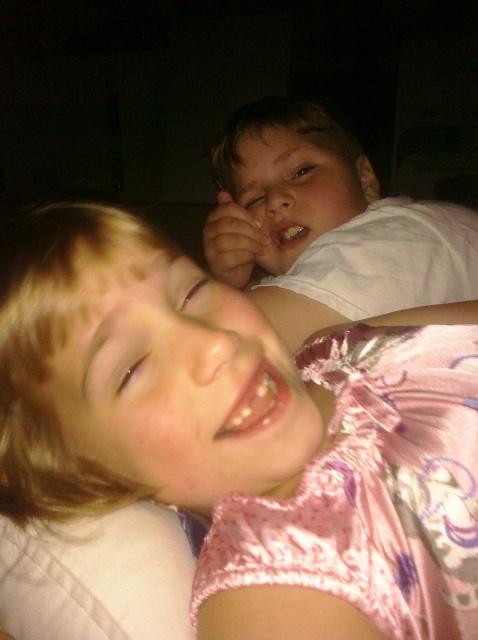
Question: Does white cotton shirt at upper center appear over smooth skin face at upper center?

Choices:
 (A) no
 (B) yes

Answer: (A)

Question: Is white cotton shirt at upper center smaller than white glossy teeth at center?

Choices:
 (A) yes
 (B) no

Answer: (B)

Question: Which object is the farthest from the smooth skin face at upper center?

Choices:
 (A) white glossy teeth at lower center
 (B) pink satin dress at center
 (C) white cotton shirt at upper center
 (D) white glossy teeth at center

Answer: (A)

Question: Among these objects, which one is nearest to the camera?

Choices:
 (A) white glossy teeth at lower center
 (B) smooth skin face at upper center
 (C) white cotton shirt at upper center
 (D) pink satin face at lower left

Answer: (D)

Question: Can you confirm if smooth skin face at upper center is positioned to the right of white glossy teeth at lower center?

Choices:
 (A) no
 (B) yes

Answer: (B)

Question: Among these points, which one is farthest from the camera?

Choices:
 (A) (54, 376)
 (B) (275, 225)
 (C) (279, 522)

Answer: (B)